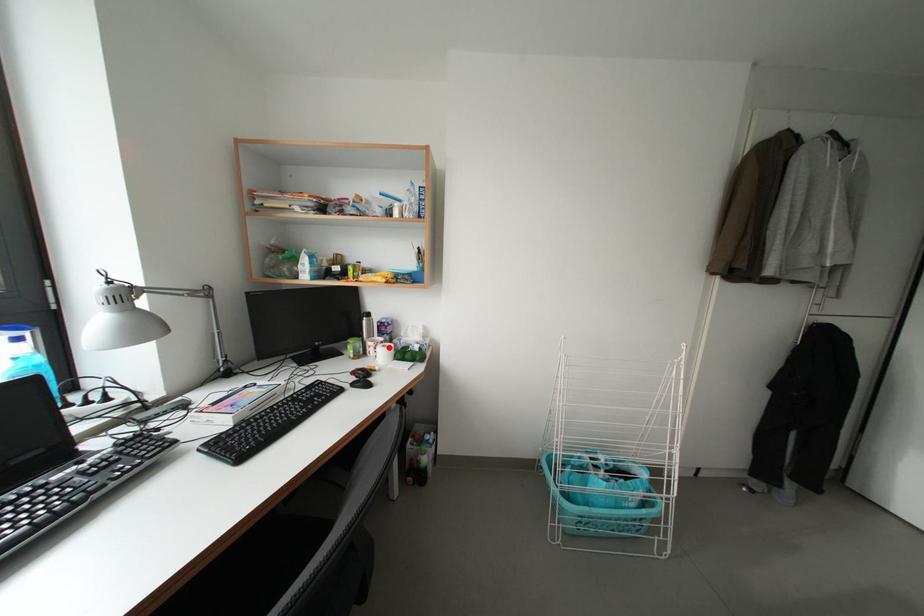
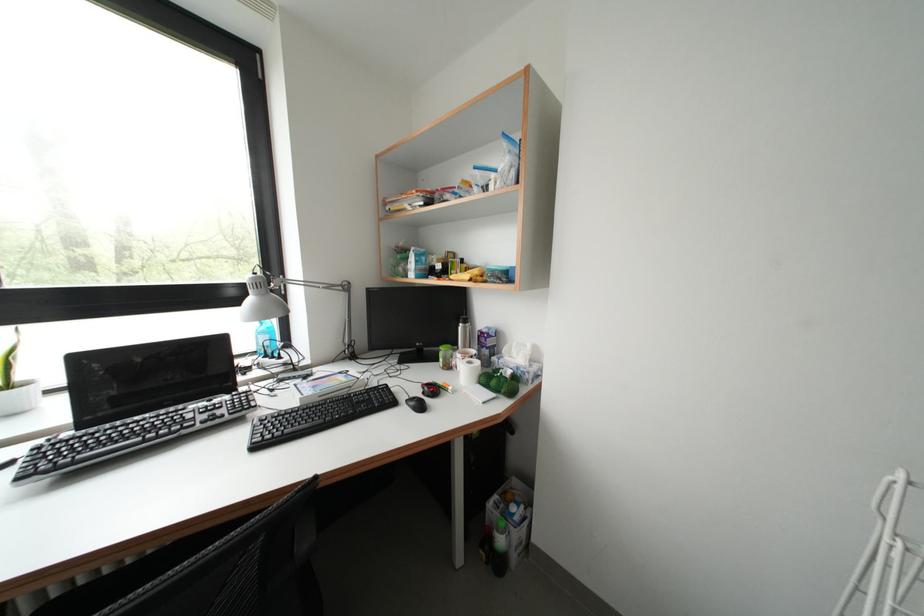
Where in the second image is the point corresponding to the highlighted location from the first image?

(479, 362)